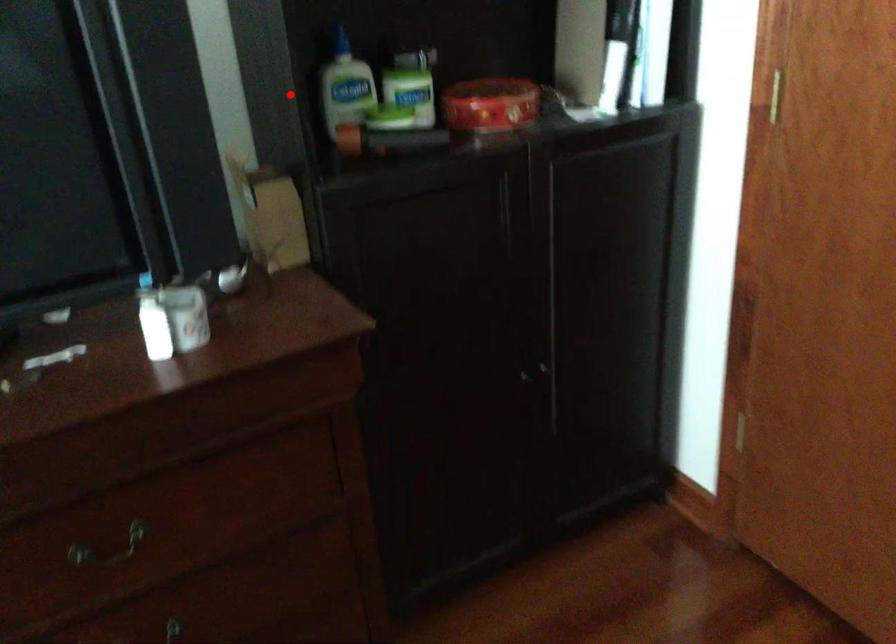
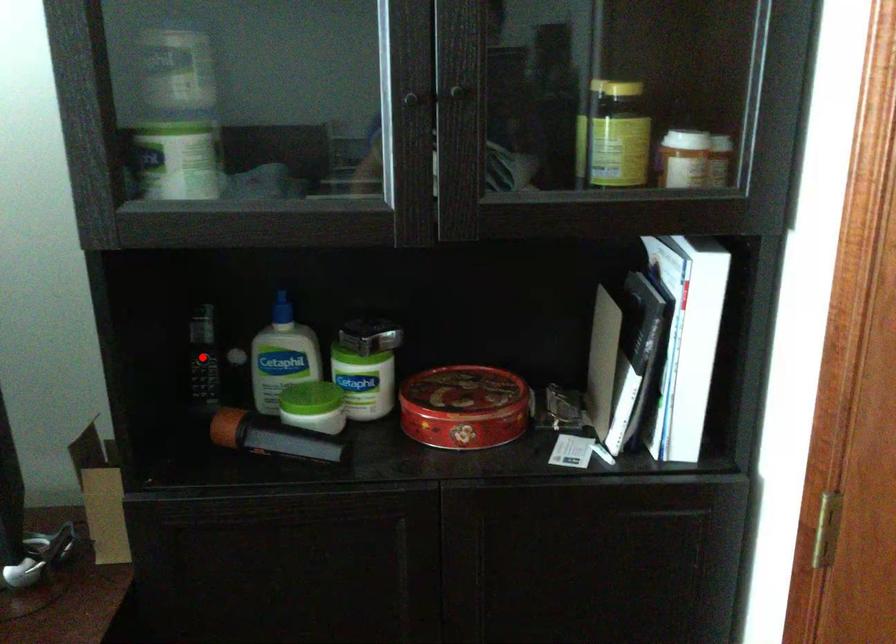
In the scene shown: I am providing you with two images of the same scene from different viewpoints. A red point is marked on the first image and another point is marked on the second image. Is the marked point in image1 the same physical position as the marked point in image2?

Yes